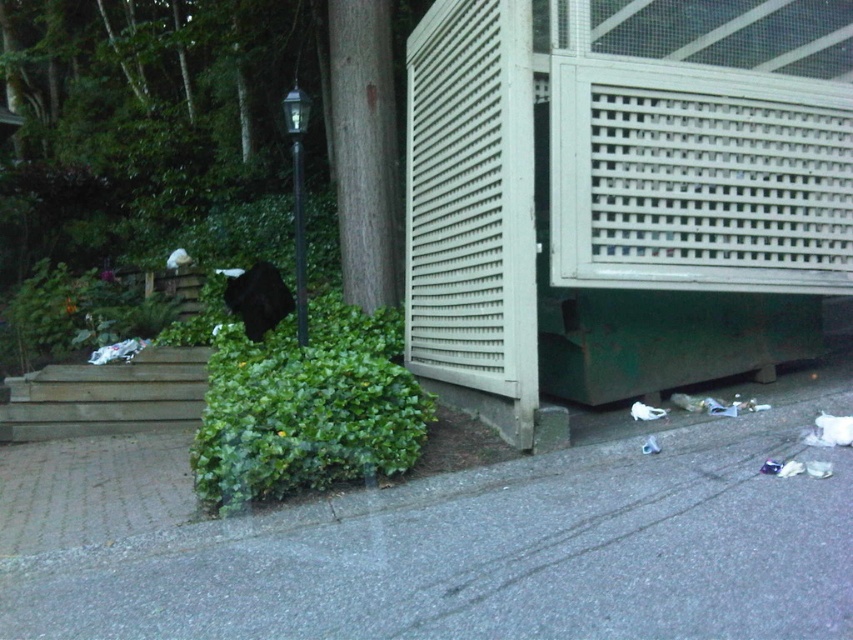
Between green textured porch at lower right and gray concrete pavement at lower center, which one has more height?

green textured porch at lower right

Between point (552, 216) and point (450, 576), which one is positioned in front?

Point (450, 576) is more forward.

Does point (793, 83) come behind point (514, 552)?

Yes, point (793, 83) is behind point (514, 552).

The width and height of the screenshot is (853, 640). I want to click on green textured porch at lower right, so click(x=614, y=205).

From the picture: Is gray concrete pavement at lower center positioned at the back of wooden stairs at lower left?

No.

Who is lower down, gray concrete pavement at lower center or wooden stairs at lower left?

gray concrete pavement at lower center is lower down.

The image size is (853, 640). I want to click on gray concrete pavement at lower center, so click(x=497, y=552).

Measure the distance between green textured porch at lower right and camera.

6.18 meters

Between point (643, 316) and point (16, 428), which one is positioned in front?

Point (643, 316) is more forward.

In the scene shown: Who is more distant from viewer, (567,116) or (131,365)?

The point (131,365) is more distant.

What are the coordinates of `green textured porch at lower right` in the screenshot? It's located at (614, 205).